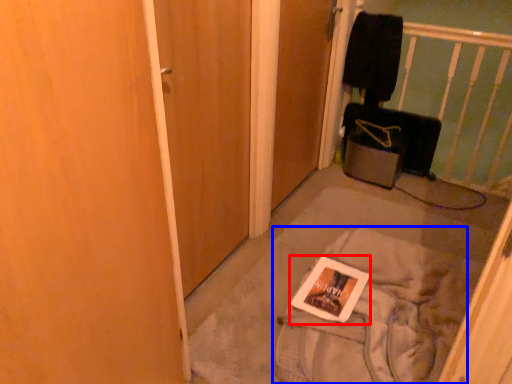
Question: Which point is closer to the camera, magazine (highlighted by a red box) or material (highlighted by a blue box)?

Choices:
 (A) magazine
 (B) material

Answer: (B)